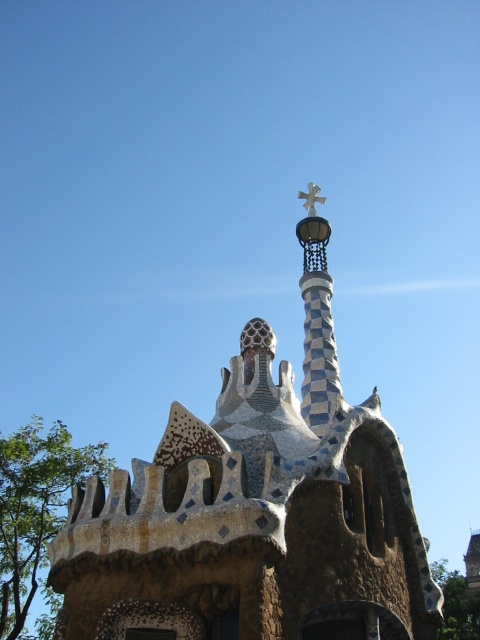
You are standing at the base of the architectural structure and looking towards the spire. You notice two points marked on the structure. The first point is at coordinates point (324, 428) and the second is at point (307, 204). Which of these points is closer to you when viewed from your current position?

Point (324, 428) is in front of point (307, 204), so it is closer to you when viewed from your current position at the base of the structure.

You are standing at the entrance of the building and want to take a photo of the mosaic tile church at center. Where should you position yourself to ensure the church is centered in your camera viewfinder?

Since the mosaic tile church at center is located at point [255,509], you should position yourself slightly to the right and lower your camera angle to center it in the viewfinder.

From the picture: You are an architect analyzing the design of the building. Based on the image, which object is located above the other between the mosaic tile church at center and the gold metallic cross at upper center?

The gold metallic cross at upper center is positioned above the mosaic tile church at center.